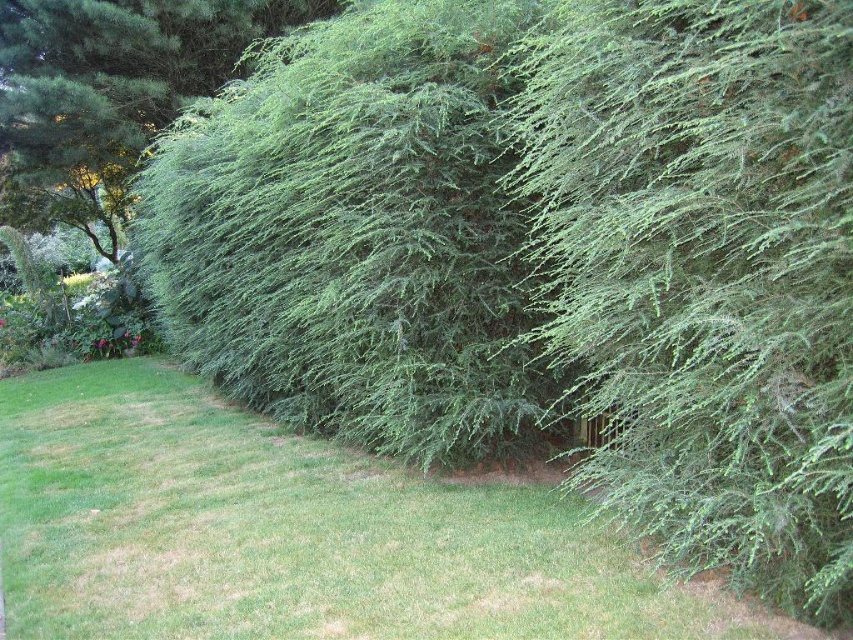
Question: Can you confirm if green leafy bush at center is thinner than green needle-like at left?

Choices:
 (A) yes
 (B) no

Answer: (A)

Question: Which object is positioned closest to the green needle-like at left?

Choices:
 (A) green leafy bush at center
 (B) green needle-like at center

Answer: (A)

Question: Which point is farther to the camera?

Choices:
 (A) (45, 125)
 (B) (583, 17)
 (C) (503, 209)

Answer: (A)

Question: Is green needle-like at center to the left of green needle-like at left from the viewer's perspective?

Choices:
 (A) yes
 (B) no

Answer: (B)

Question: Considering the real-world distances, which object is farthest from the green leafy bush at center?

Choices:
 (A) green needle-like at center
 (B) green needle-like at left

Answer: (B)

Question: Can you confirm if green leafy bush at center is smaller than green needle-like at left?

Choices:
 (A) no
 (B) yes

Answer: (A)